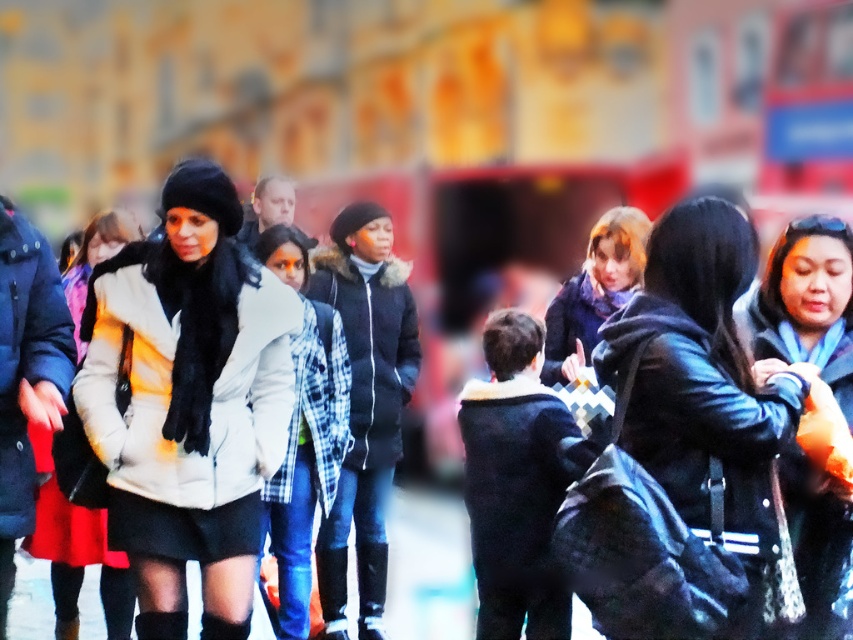
Question: Which point is farther to the camera?

Choices:
 (A) white matte jacket at center
 (B) smooth concrete pavement at lower center
 (C) white fur coat at center

Answer: (B)

Question: Does white fur coat at center have a smaller size compared to leather jacket at right?

Choices:
 (A) no
 (B) yes

Answer: (A)

Question: Which object is closer to the camera taking this photo?

Choices:
 (A) matte black jacket at center
 (B) black leather boot at lower center
 (C) smooth concrete pavement at lower center
 (D) leather jacket at right

Answer: (A)

Question: Is white fur coat at center below leather boot at center?

Choices:
 (A) no
 (B) yes

Answer: (A)

Question: Which point appears farthest from the camera in this image?

Choices:
 (A) (305, 368)
 (B) (405, 586)

Answer: (B)

Question: Is leather jacket at right to the left of white matte jacket at center from the viewer's perspective?

Choices:
 (A) no
 (B) yes

Answer: (A)